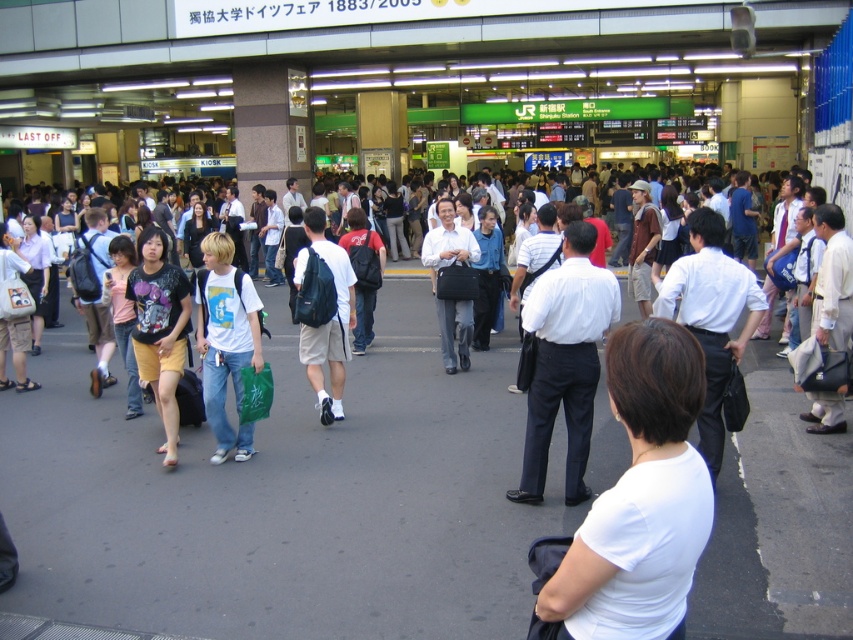
You are a delivery person carrying a package that requires a clear path to the service counter located at the entrance of JR Shinjuku Station. You notice a person wearing a white matte shirt at center and a commuter with a matte black backpack at center in your way. Can you pass between them without needing to move either individual, given the space between them?

The distance between the white matte shirt at center and the matte black backpack at center is 5.49 meters. Since the required space for a delivery person with a package is typically around 1 meter, there is sufficient space to pass between them without needing to move either individual.

You are a photographer at the train station and want to take a picture of the white matte shirt at center and the matte black backpack at center. Which object should you focus on first if you want to capture both in the same frame without adjusting your camera settings?

The white matte shirt at center has a lesser height compared to matte black backpack at center, so you should focus on the white matte shirt at center first to ensure it is in focus before the taller matte black backpack at center.